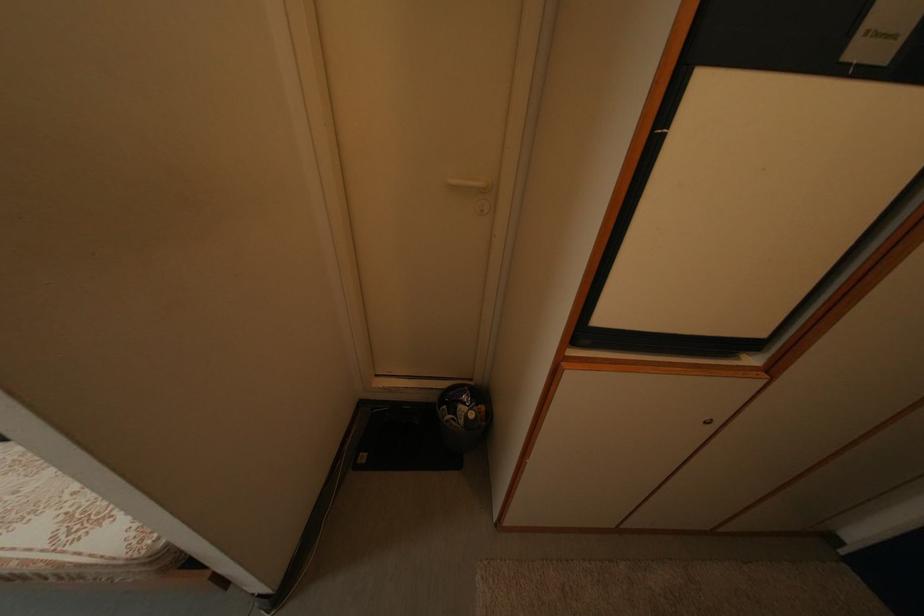
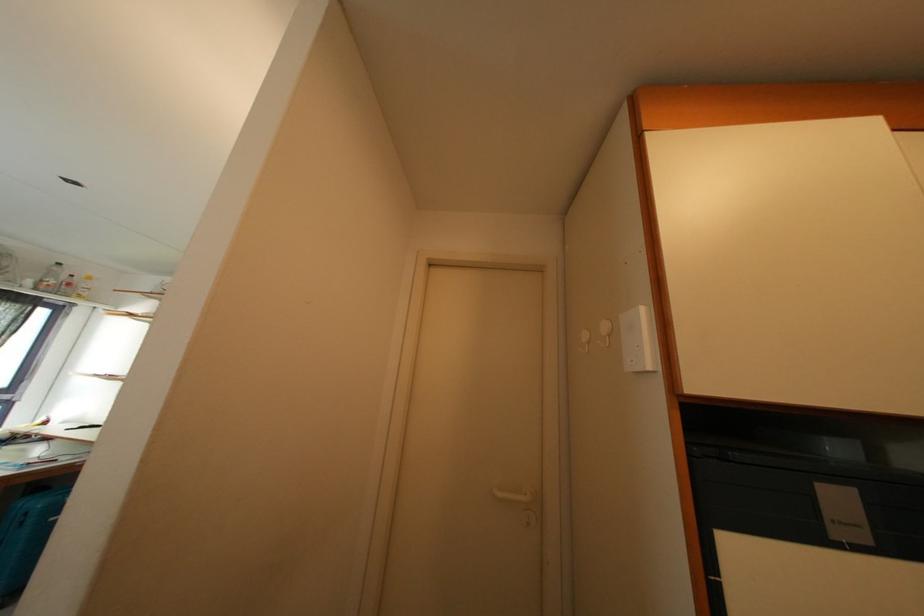
In the second image, find the point that corresponds to pixel 463 187 in the first image.

(507, 499)